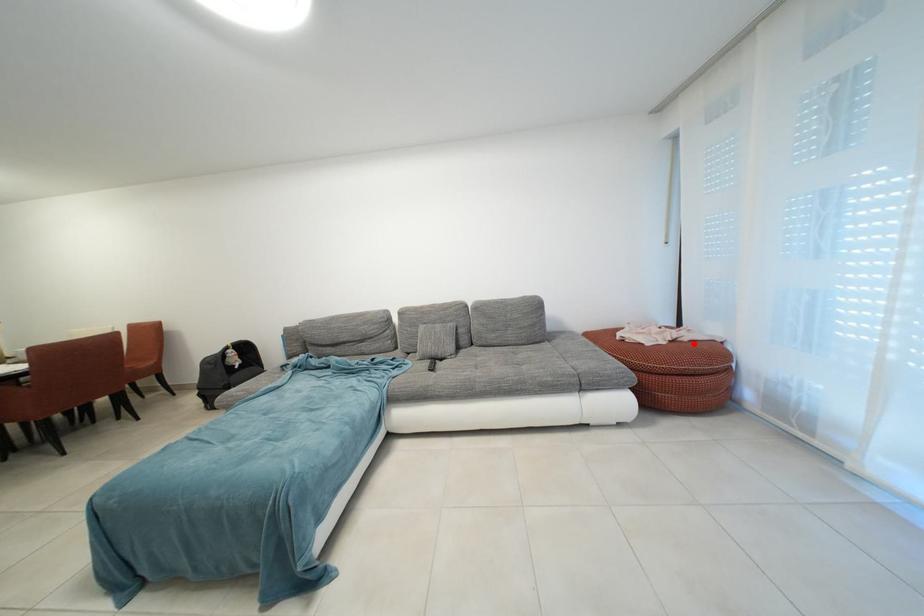
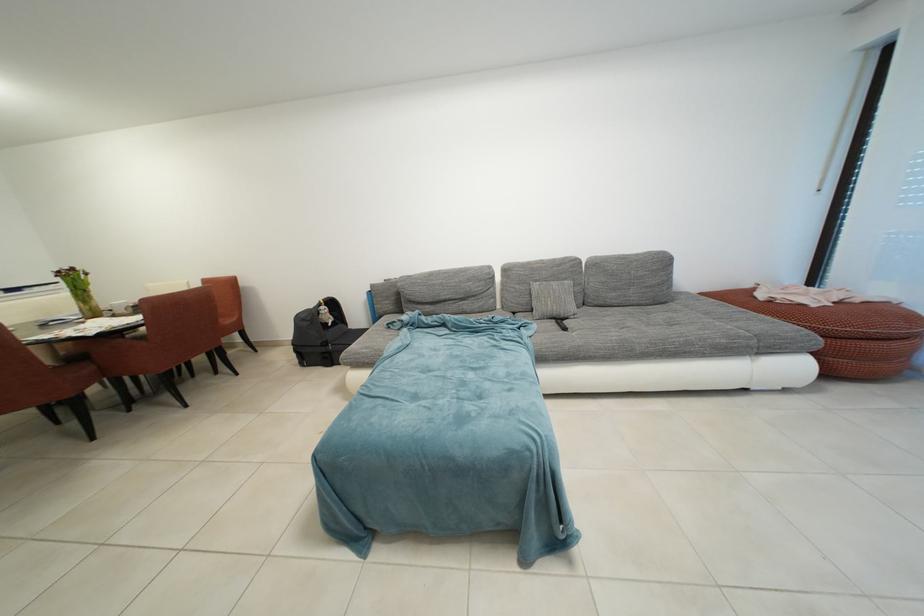
Question: I am providing you with two images of the same scene from different viewpoints. Image1 has a red point marked. In image2, the corresponding 3D location appears at what relative position? Reply with the corresponding letter.

Choices:
 (A) Closer
 (B) Farther

Answer: (B)